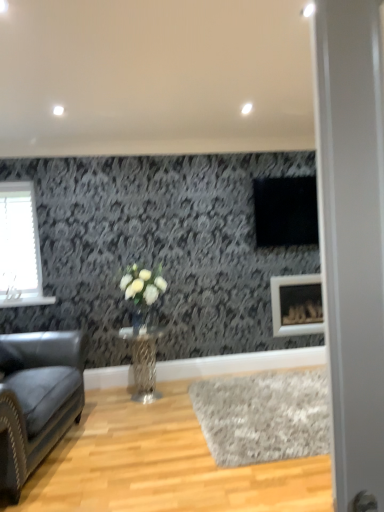
Question: Should I look upward or downward to see clear glass vase at center?

Choices:
 (A) up
 (B) down

Answer: (B)

Question: From a real-world perspective, is clear glass vase at center positioned under transparent glass door at right based on gravity?

Choices:
 (A) no
 (B) yes

Answer: (B)

Question: Is clear glass vase at center taller than transparent glass door at right?

Choices:
 (A) no
 (B) yes

Answer: (A)

Question: Is clear glass vase at center facing away from transparent glass door at right?

Choices:
 (A) yes
 (B) no

Answer: (B)

Question: Is the depth of clear glass vase at center greater than that of transparent glass door at right?

Choices:
 (A) yes
 (B) no

Answer: (A)

Question: Can you see clear glass vase at center touching transparent glass door at right?

Choices:
 (A) yes
 (B) no

Answer: (B)

Question: Could you tell me if clear glass vase at center is turned towards transparent glass door at right?

Choices:
 (A) no
 (B) yes

Answer: (B)

Question: Is metallic textured table at center bigger than white matte picture frame at lower right?

Choices:
 (A) yes
 (B) no

Answer: (A)

Question: Is metallic textured table at center touching white matte picture frame at lower right?

Choices:
 (A) no
 (B) yes

Answer: (A)

Question: From the image's perspective, is metallic textured table at center located above white matte picture frame at lower right?

Choices:
 (A) no
 (B) yes

Answer: (A)

Question: Is metallic textured table at center outside white matte picture frame at lower right?

Choices:
 (A) no
 (B) yes

Answer: (B)

Question: Is white matte picture frame at lower right at the back of metallic textured table at center?

Choices:
 (A) no
 (B) yes

Answer: (A)

Question: Does metallic textured table at center have a lesser height compared to white matte picture frame at lower right?

Choices:
 (A) yes
 (B) no

Answer: (A)

Question: Can you confirm if leather couch at left is wider than gray shag rug at lower center?

Choices:
 (A) yes
 (B) no

Answer: (B)